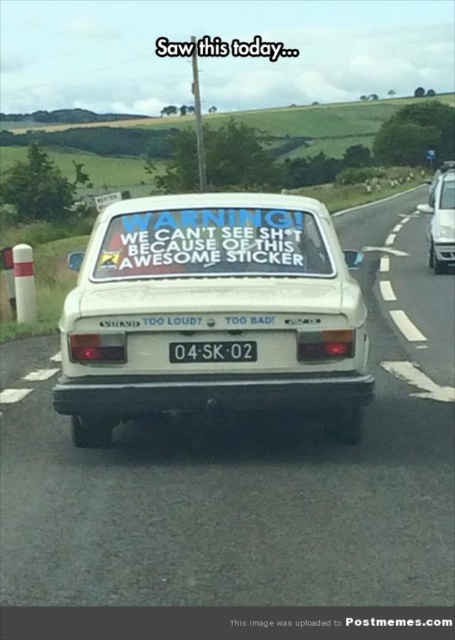
You are a pedestrian standing on the sidewalk next to the road. You see the white matte car at right and the black plastic license plate at center. Which object takes up more space in the image?

The white matte car at right is larger in size than the black plastic license plate at center, so it takes up more space in the image.

You are a pedestrian standing at the point with coordinates (440, 218). Looking around, you see a white matte car at right. Is the white matte car at right located to your left or right side?

The white matte car at right is located to your right side since you are at point (440, 218) and the car is at the right side of the frame.

Looking at this image, you are a pedestrian standing on the side of the road and see the white matte car at right and the black plastic license plate at center. Which object is closer to you?

The white matte car at right is closer to you because it is further to the viewer than the black plastic license plate at center.